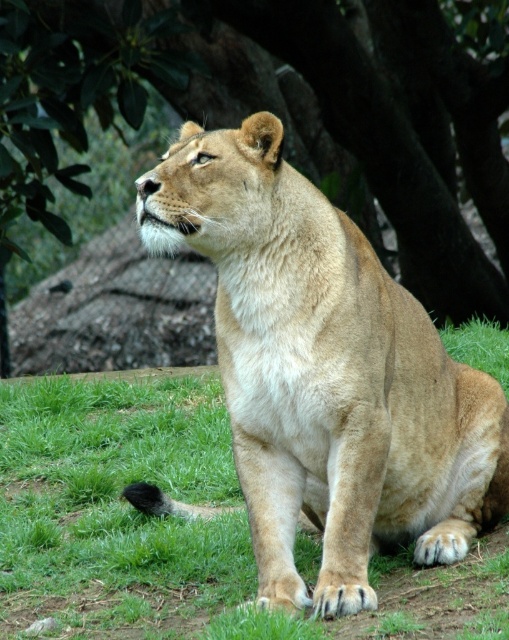
You are a zookeeper observing the lioness in her enclosure. You notice the golden fur lion at center and the green grass at center. Which object is closer to you from your observation point?

The golden fur lion at center is closer to you because it is in front of the green grass at center.

You are a zookeeper planning to place a new feeding station between the green leafy tree at upper left and the golden fur lion at center. Since the feeding station requires a space that can accommodate the larger object, which object should determine the minimum required space?

The green leafy tree at upper left is larger in size than the golden fur lion at center, so the feeding station must be sized to accommodate the green leafy tree at upper left.